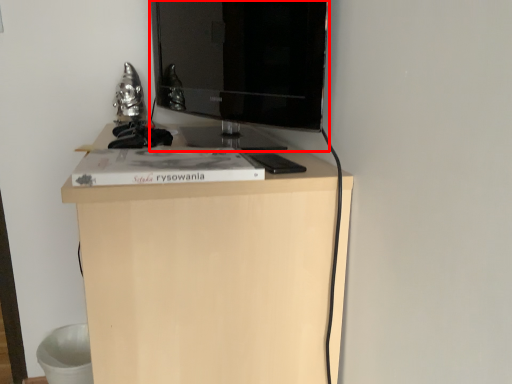
Question: From the image's perspective, considering the relative positions of television (annotated by the red box) and furniture in the image provided, where is television (annotated by the red box) located with respect to the staircase?

Choices:
 (A) below
 (B) above

Answer: (B)